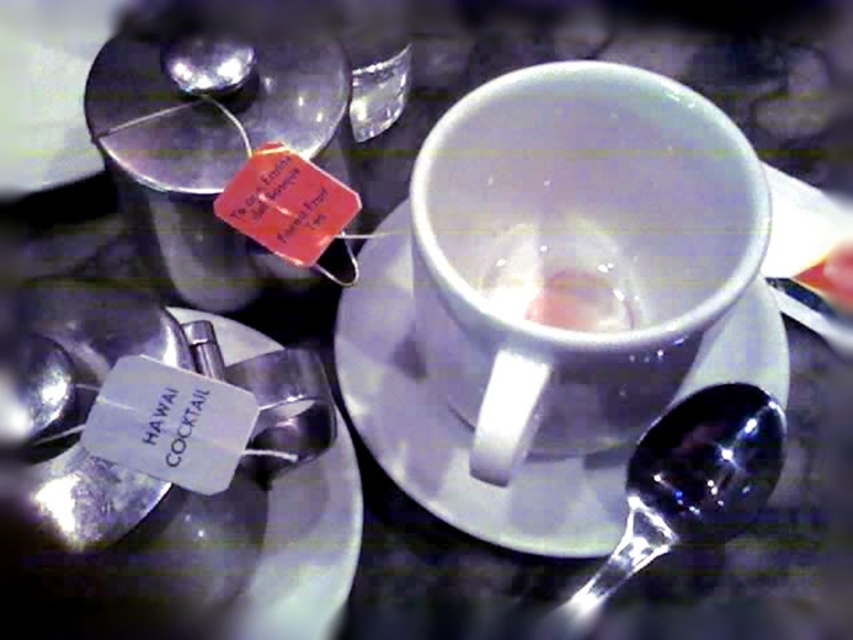
Question: Is white glossy mug at center bigger than white paper tag at lower left?

Choices:
 (A) no
 (B) yes

Answer: (B)

Question: Based on their relative distances, which object is nearer to the shiny silver spoon at lower right?

Choices:
 (A) white paper tag at lower left
 (B) white ceramic saucer at center
 (C) white glossy mug at center
 (D) clear glass cup at center

Answer: (B)

Question: Which point is closer to the camera?

Choices:
 (A) white ceramic saucer at center
 (B) white glossy mug at center
 (C) shiny silver spoon at lower right

Answer: (B)

Question: Does white glossy mug at center appear on the right side of white ceramic saucer at center?

Choices:
 (A) no
 (B) yes

Answer: (A)

Question: Which point is farther to the camera?

Choices:
 (A) white glossy mug at center
 (B) clear glass cup at center
 (C) white ceramic saucer at center

Answer: (C)

Question: Is white paper tag at lower left behind white ceramic saucer at center?

Choices:
 (A) no
 (B) yes

Answer: (A)